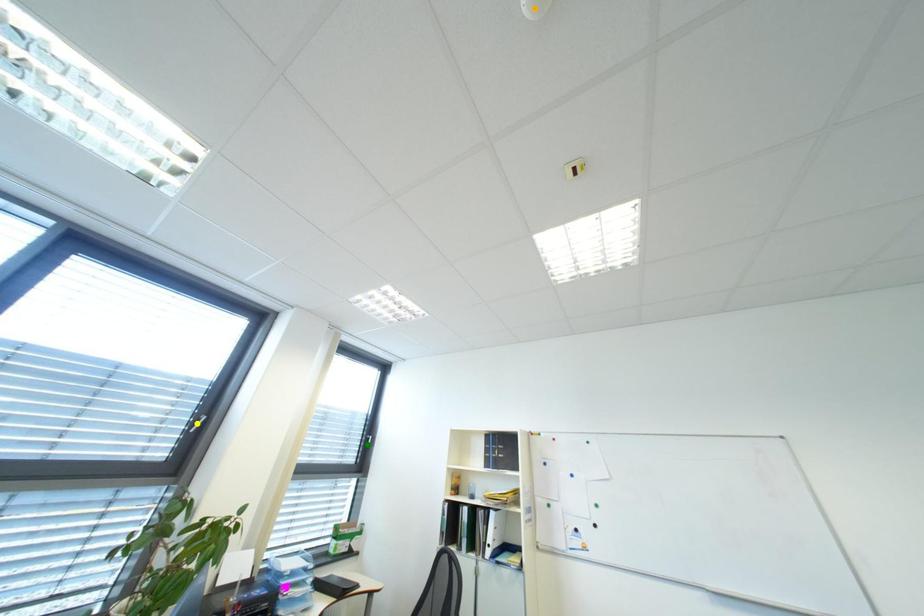
Order these from nearest to farthest:
- orange point
- yellow point
- green point

orange point, yellow point, green point